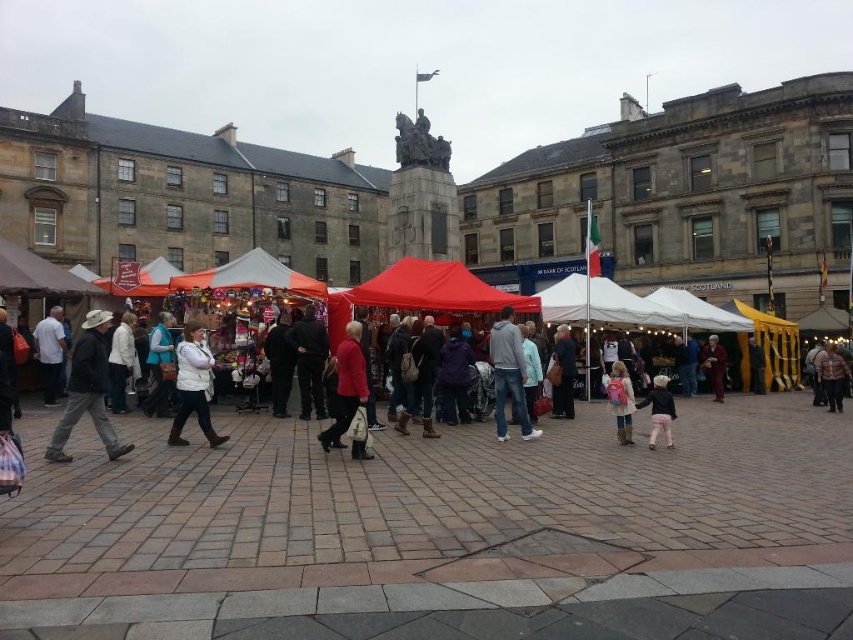
Question: Based on their relative distances, which object is nearer to the white fleece vest at center?

Choices:
 (A) brown woolen hat at lower right
 (B) matte gray hoodie at center
 (C) matte red coat at center

Answer: (C)

Question: Which point appears closest to the camera in this image?

Choices:
 (A) (509, 330)
 (B) (341, 397)
 (C) (190, 346)

Answer: (B)

Question: Which point is farther to the camera?

Choices:
 (A) (844, 384)
 (B) (120, 449)
 (C) (496, 364)
 (D) (201, 387)

Answer: (A)

Question: Can you confirm if matte red coat at center is thinner than pink backpack at center?

Choices:
 (A) yes
 (B) no

Answer: (B)

Question: Does pink backpack at center appear over brown woolen hat at lower right?

Choices:
 (A) no
 (B) yes

Answer: (A)

Question: Is matte red coat at center above light pink fabric pants at lower right?

Choices:
 (A) yes
 (B) no

Answer: (A)